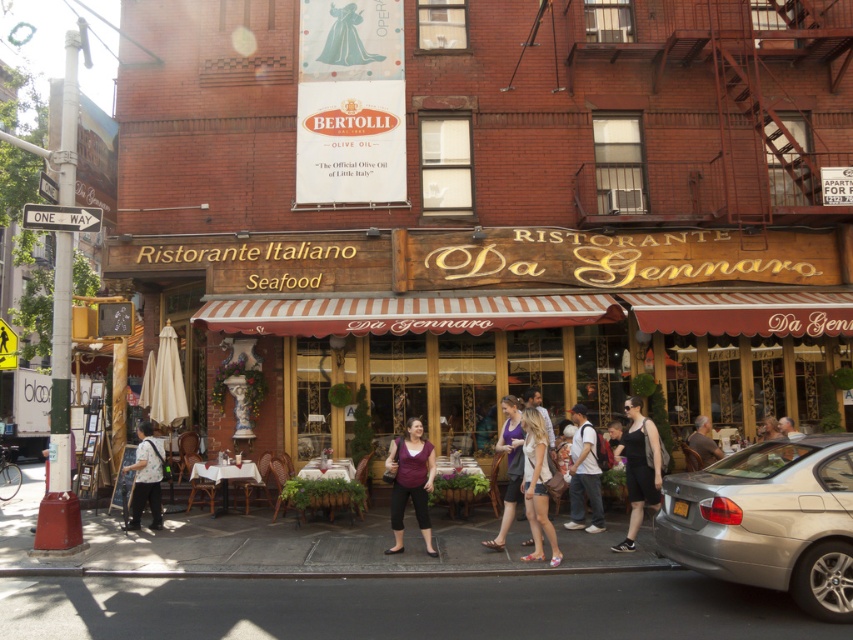
Does white cotton shirt at center have a lesser width compared to matte black shirt at center?

Yes.

Measure the distance between white cotton shirt at center and matte black shirt at center.

The distance of white cotton shirt at center from matte black shirt at center is 5.40 feet.

Who is more distant from viewer, (537,417) or (590,499)?

Point (590,499)

Find the location of a particular element. Image resolution: width=853 pixels, height=640 pixels. white cotton shirt at center is located at coordinates (537, 486).

Consider the image. Is purple matte shirt at center smaller than matte black shirt at center?

Yes.

Does purple matte shirt at center appear on the right side of matte black shirt at center?

No, purple matte shirt at center is not to the right of matte black shirt at center.

Where is `purple matte shirt at center`? The height and width of the screenshot is (640, 853). purple matte shirt at center is located at coordinates (410, 483).

This screenshot has width=853, height=640. I want to click on purple matte shirt at center, so click(410, 483).

Who is positioned more to the left, black fabric dress at lower right or white cotton shirt at center?

Positioned to the left is white cotton shirt at center.

Is black fabric dress at lower right thinner than white cotton shirt at center?

No, black fabric dress at lower right is not thinner than white cotton shirt at center.

Does point (633, 444) come farther from viewer compared to point (544, 531)?

Yes, it is.

Image resolution: width=853 pixels, height=640 pixels. I want to click on black fabric dress at lower right, so click(x=639, y=468).